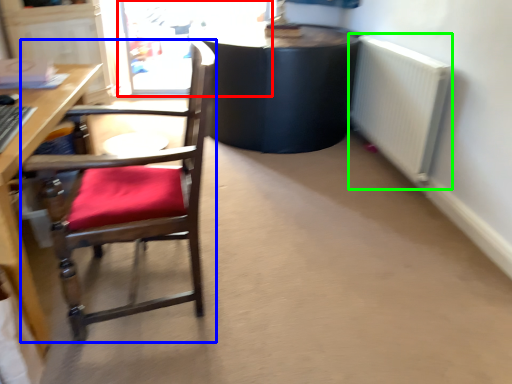
Question: Based on their relative distances, which object is nearer to screen door (highlighted by a red box)? Choose from chair (highlighted by a blue box) and radiator (highlighted by a green box).

Choices:
 (A) chair
 (B) radiator

Answer: (B)